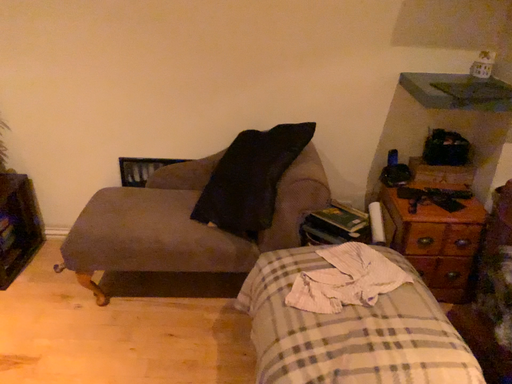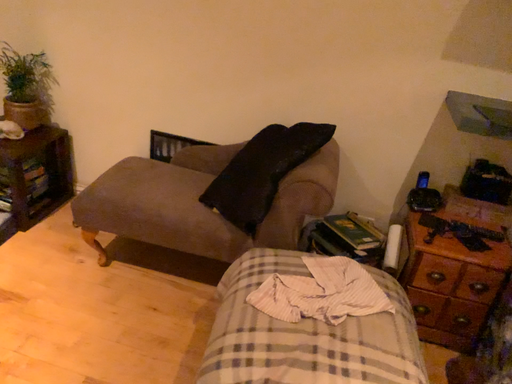
Question: How did the camera likely rotate when shooting the video?

Choices:
 (A) rotated right
 (B) rotated left

Answer: (B)